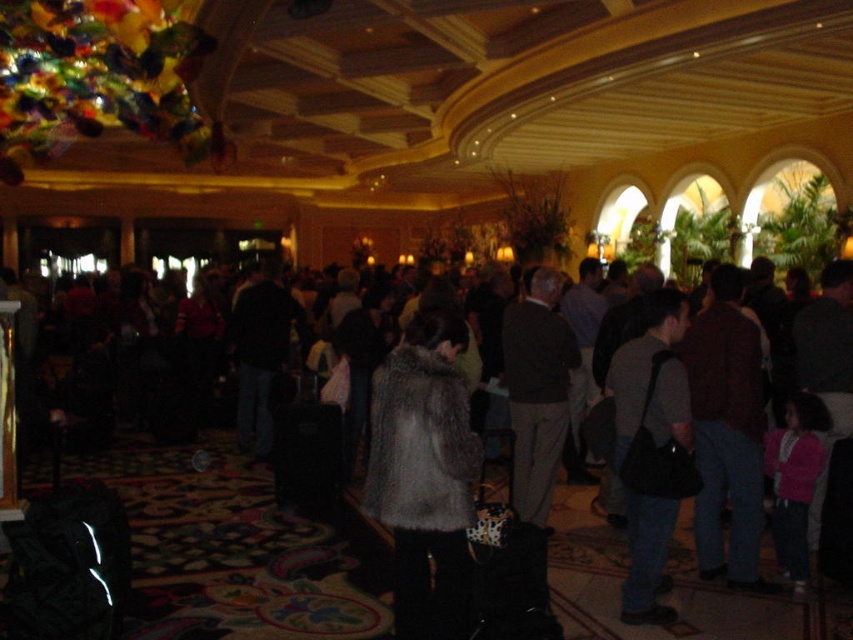
You are standing at the entrance of the lobby and see the fuzzy gray coat at center. If you want to walk directly towards it, what direction should you head in?

Since the fuzzy gray coat at center is located at point 0.744 on the x axis and 0.498 on the y axis, you should head towards the center of the lobby to reach it.

You are a hotel staff member who needs to store two items in a rectangular closet. The fuzzy gray coat at center and the dark gray suit at center must be placed in the same closet. Given their sizes, can both items fit side by side in the closet without overlapping?

The fuzzy gray coat at center has a smaller width than the dark gray suit at center. Since the coat is narrower, both items can likely fit side by side in the closet as long as the total width of both items does not exceed the closet space available.